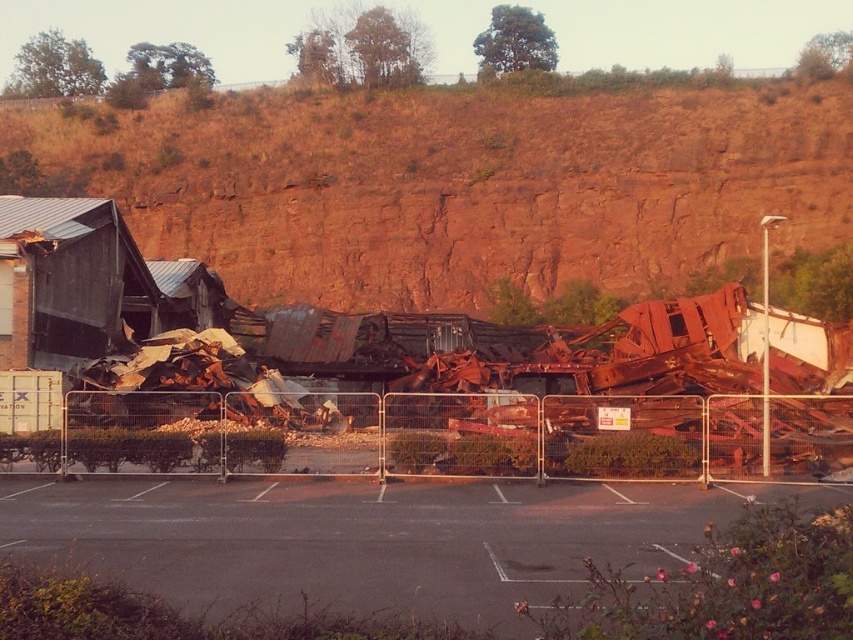
Question: Observing the image, what is the correct spatial positioning of rusty metal hillside at upper center in reference to dark asphalt parking lot at center?

Choices:
 (A) above
 (B) below

Answer: (A)

Question: Is rusty metal hillside at upper center bigger than dark asphalt parking lot at center?

Choices:
 (A) no
 (B) yes

Answer: (B)

Question: Which point is closer to the camera?

Choices:
 (A) dark asphalt parking lot at center
 (B) rusty metal hillside at upper center

Answer: (A)

Question: Can you confirm if rusty metal hillside at upper center is thinner than dark asphalt parking lot at center?

Choices:
 (A) no
 (B) yes

Answer: (A)

Question: Which of the following is the farthest from the observer?

Choices:
 (A) dark asphalt parking lot at center
 (B) rusty metal hillside at upper center

Answer: (B)